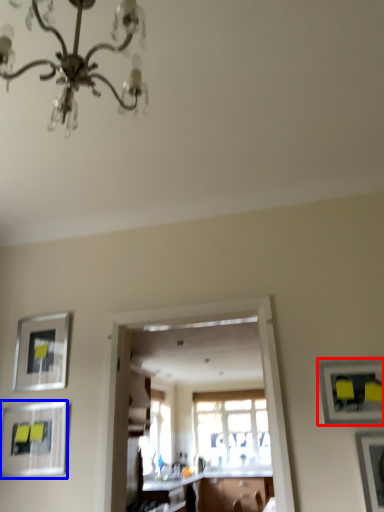
Question: Among these objects, which one is nearest to the camera, picture frame (highlighted by a red box) or picture frame (highlighted by a blue box)?

Choices:
 (A) picture frame
 (B) picture frame

Answer: (A)